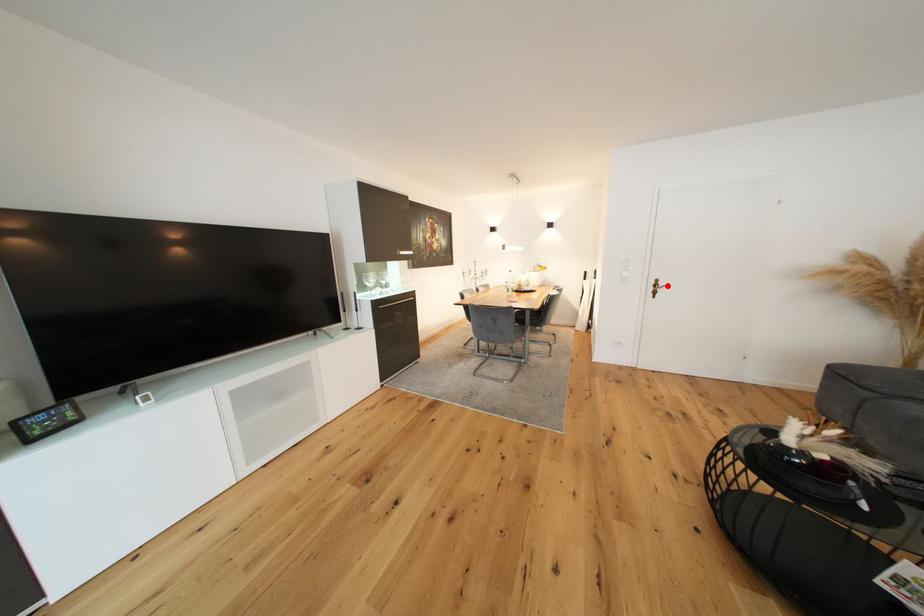
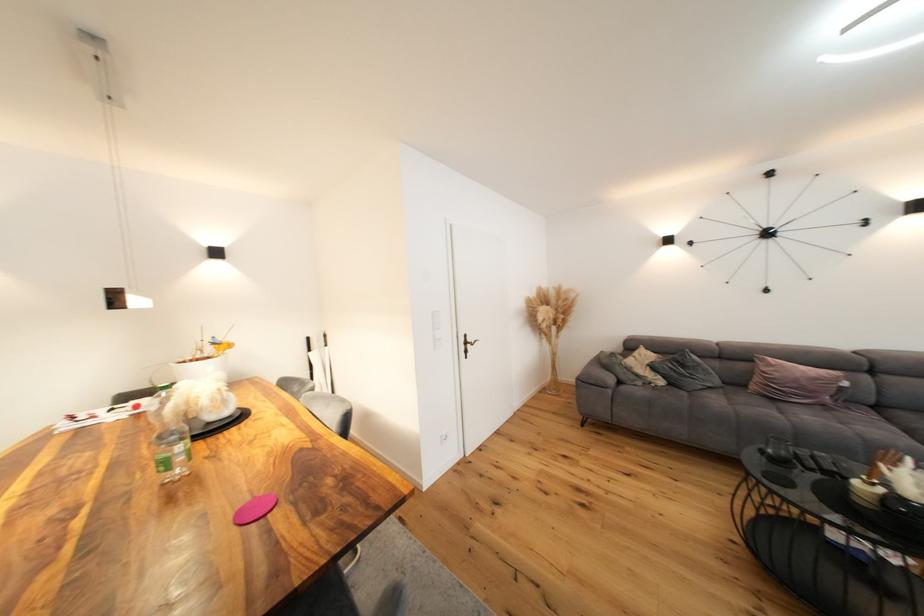
Question: I am providing you with two images of the same scene from different viewpoints. Given a red point in image1, look at the same physical point in image2. Is it:

Choices:
 (A) Closer to the viewpoint
 (B) Farther from the viewpoint

Answer: (B)